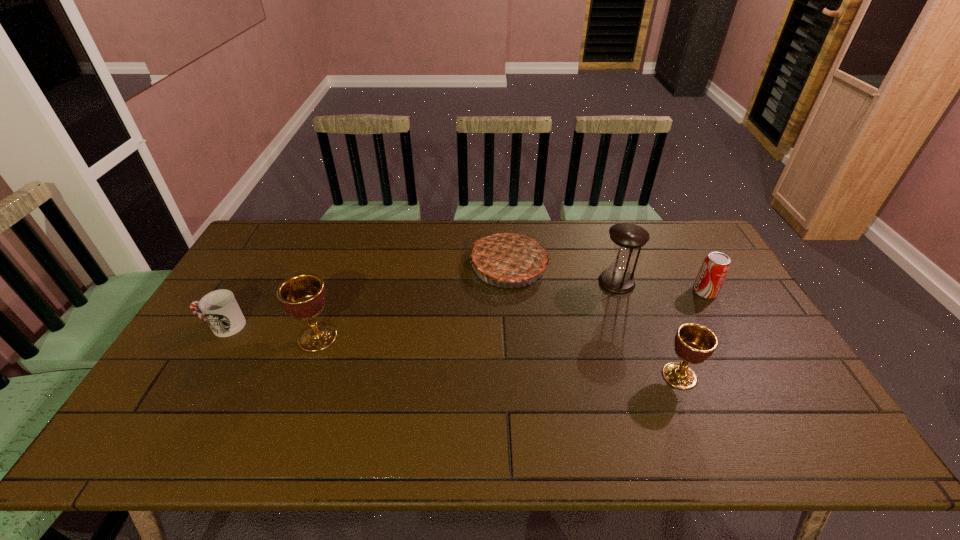
Identify the location of vacant space located on the left of the nearer chalice. (560, 376).

Find the location of `blank space located 0.320m on the back of the soda can`. blank space located 0.320m on the back of the soda can is located at coordinates (668, 227).

You are a GUI agent. You are given a task and a screenshot of the screen. Output one action in this format:
    pyautogui.click(x=<x>, y=<y>)
    Task: Click on the blank space located 0.080m on the front of the third object from left to right
    Image resolution: width=960 pixels, height=540 pixels.
    Given the screenshot: What is the action you would take?
    pyautogui.click(x=513, y=310)

The width and height of the screenshot is (960, 540). I want to click on free space located 0.090m on the front of the hourglass, so click(x=629, y=315).

The image size is (960, 540). Identify the location of object located at the far edge. (508, 257).

Locate an element on the screen. object situated at the near edge is located at coordinates (694, 343).

Find the location of `object positioned at the left edge`. object positioned at the left edge is located at coordinates (219, 308).

Where is `object located at the right edge`? Image resolution: width=960 pixels, height=540 pixels. object located at the right edge is located at coordinates (715, 267).

The width and height of the screenshot is (960, 540). In the image, there is a desktop. In order to click on vacant space at the far edge in this screenshot , I will do `click(588, 226)`.

Find the location of a particular element. vacant space at the left edge of the desktop is located at coordinates (184, 359).